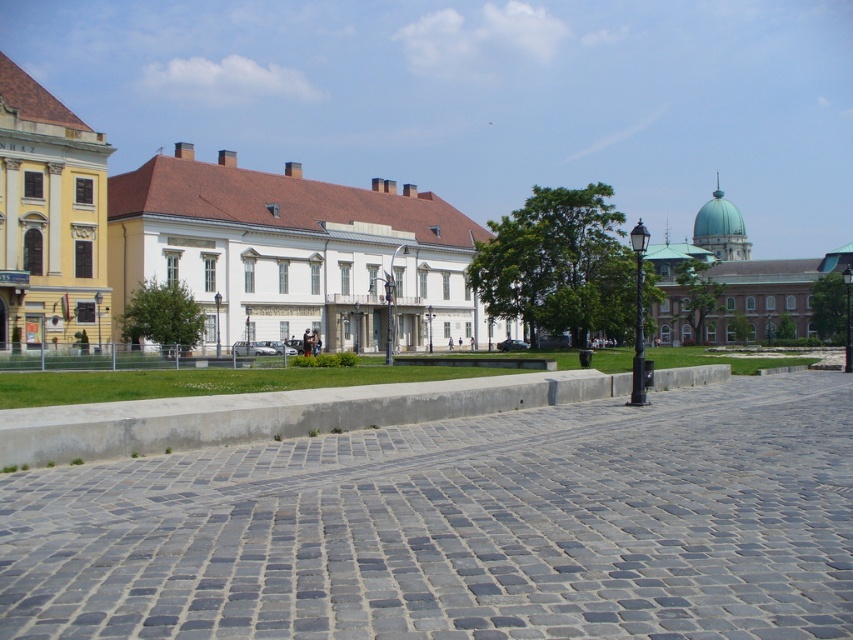
Is gray cobblestone pavement at center to the right of white smooth building at center from the viewer's perspective?

Yes, gray cobblestone pavement at center is to the right of white smooth building at center.

Is gray cobblestone pavement at center taller than white smooth building at center?

No.

Which is behind, point (242, 488) or point (135, 182)?

The point (135, 182) is behind.

Find the location of a particular element. gray cobblestone pavement at center is located at coordinates (460, 528).

Who is more forward, (x=610, y=634) or (x=10, y=65)?

Point (x=610, y=634) is more forward.

Describe the element at coordinates (460, 528) in the screenshot. I see `gray cobblestone pavement at center` at that location.

Where is `gray cobblestone pavement at center`? The width and height of the screenshot is (853, 640). gray cobblestone pavement at center is located at coordinates (460, 528).

Which of these two, gray cobblestone pavement at center or teal dome building at upper right, stands shorter?

With less height is gray cobblestone pavement at center.

Which is behind, point (780, 500) or point (763, 288)?

The point (763, 288) is behind.

Who is more forward, [419,465] or [680,336]?

Positioned in front is point [419,465].

The height and width of the screenshot is (640, 853). I want to click on gray cobblestone pavement at center, so click(460, 528).